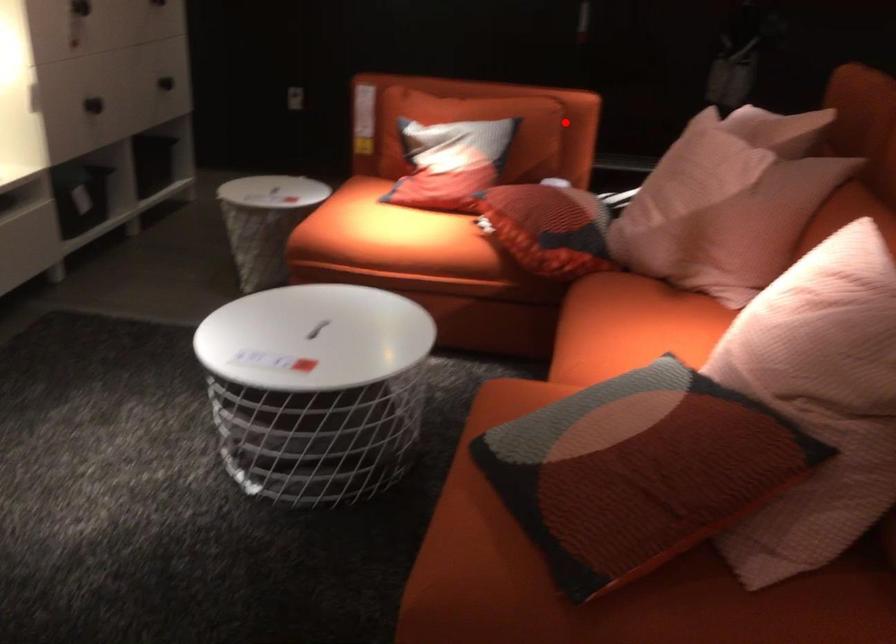
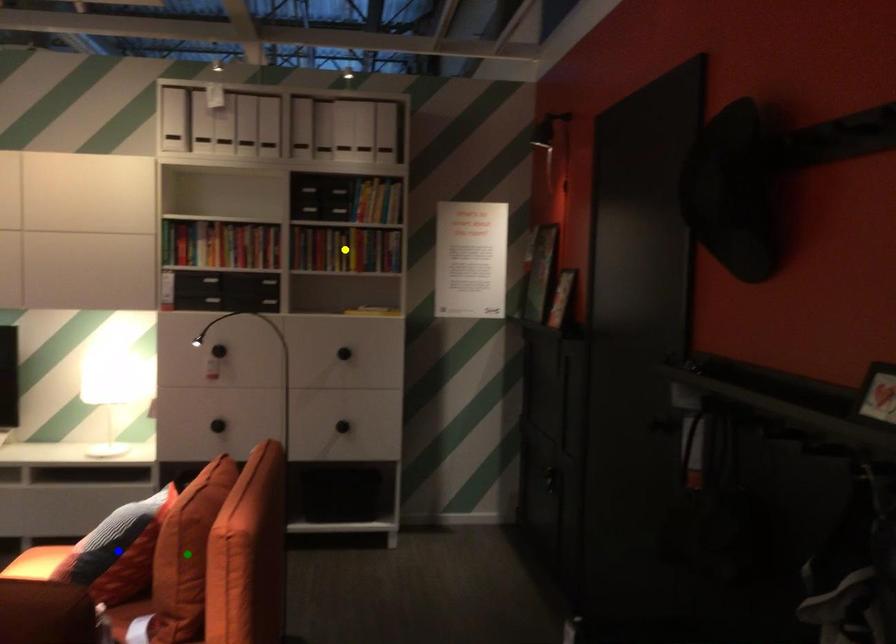
Question: I am providing you with two images of the same scene from different viewpoints. A red point is marked on the first image. You are given multiple points on the second image. Can you choose the point in image 2 that corresponds to the point in image 1?

Choices:
 (A) blue point
 (B) green point
 (C) yellow point

Answer: (B)